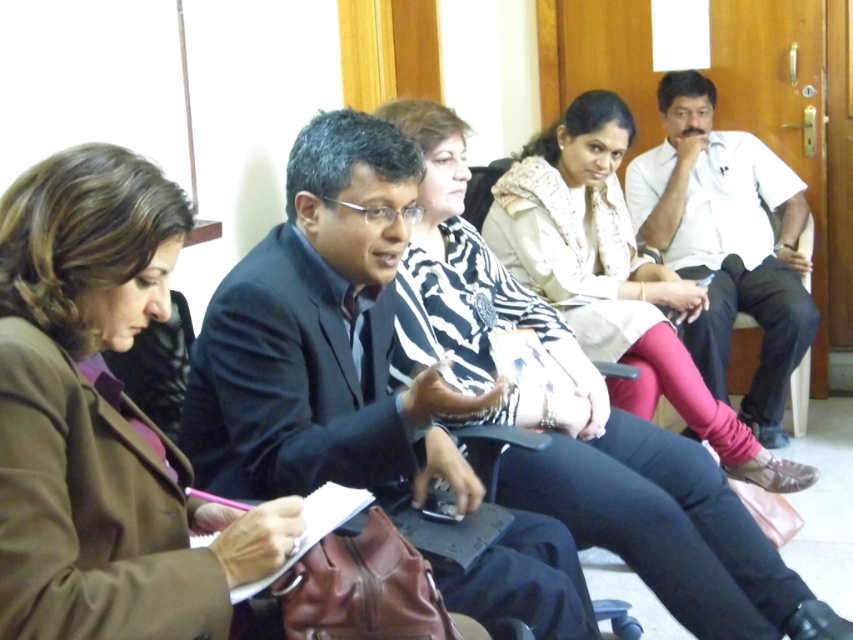
Does dark suit at center have a greater height compared to zebra print scarf at center?

Incorrect, dark suit at center's height is not larger of zebra print scarf at center's.

Can you confirm if dark suit at center is positioned to the right of zebra print scarf at center?

In fact, dark suit at center is to the left of zebra print scarf at center.

Between point (395, 390) and point (730, 550), which one is positioned behind?

Positioned behind is point (730, 550).

This screenshot has width=853, height=640. I want to click on dark suit at center, so pos(322,337).

Is brown leather jacket at left shorter than zebra print scarf at center?

Yes.

This screenshot has width=853, height=640. Identify the location of brown leather jacket at left. (102, 419).

The image size is (853, 640). In order to click on brown leather jacket at left in this screenshot , I will do `click(102, 419)`.

Does zebra print scarf at center have a lesser height compared to white cotton shirt at right?

Yes, zebra print scarf at center is shorter than white cotton shirt at right.

How distant is zebra print scarf at center from white cotton shirt at right?

zebra print scarf at center is 1.41 meters from white cotton shirt at right.

Who is more forward, (479, 244) or (729, 161)?

Point (479, 244) is in front.

The image size is (853, 640). In order to click on zebra print scarf at center in this screenshot , I will do `click(585, 426)`.